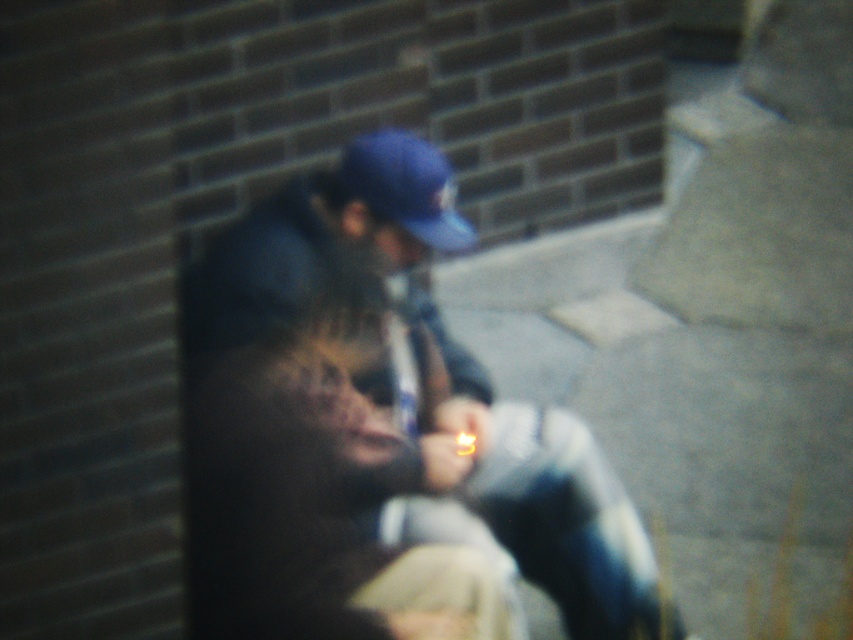
The width and height of the screenshot is (853, 640). In order to click on blue denim jacket at center in this screenshot , I will do `click(380, 435)`.

From the picture: Can you confirm if blue denim jacket at center is taller than blue matte baseball cap at center?

Correct, blue denim jacket at center is much taller as blue matte baseball cap at center.

The height and width of the screenshot is (640, 853). Find the location of `blue denim jacket at center`. blue denim jacket at center is located at coordinates (380, 435).

Locate an element on the screen. blue denim jacket at center is located at coordinates (380, 435).